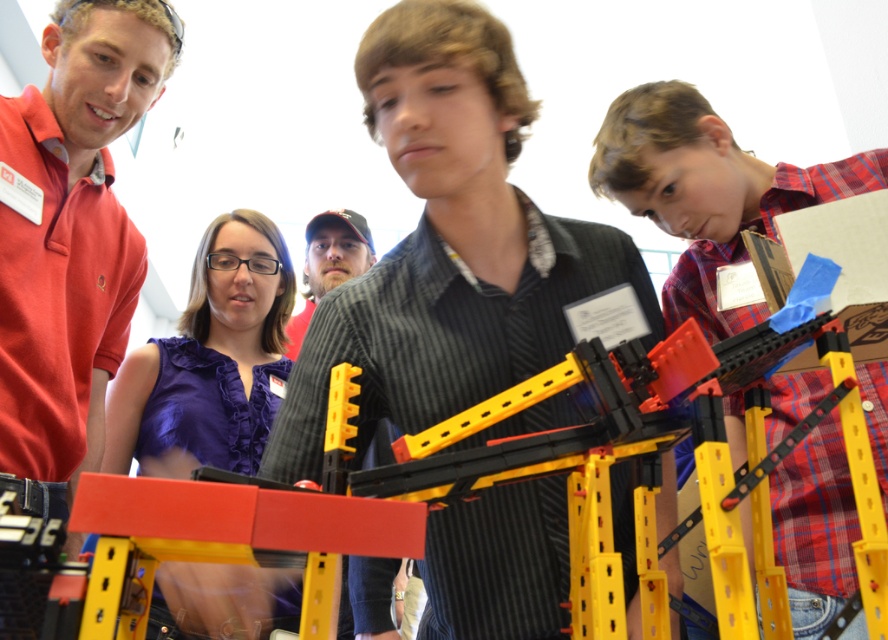
Question: Is matte red shirt at left smaller than purple fabric shirt at center?

Choices:
 (A) yes
 (B) no

Answer: (B)

Question: Observing the image, what is the correct spatial positioning of matte black shirt at center in reference to matte red shirt at left?

Choices:
 (A) left
 (B) right

Answer: (B)

Question: Based on their relative distances, which object is nearer to the red plastic lego at center?

Choices:
 (A) purple fabric shirt at center
 (B) matte black shirt at center
 (C) matte black cap at center

Answer: (B)

Question: Which object is farther from the camera taking this photo?

Choices:
 (A) matte red shirt at left
 (B) purple fabric shirt at center
 (C) matte black shirt at center
 (D) matte black cap at center

Answer: (D)

Question: Is red plastic lego at center in front of matte black cap at center?

Choices:
 (A) yes
 (B) no

Answer: (A)

Question: Which object appears farthest from the camera in this image?

Choices:
 (A) purple fabric shirt at center
 (B) red plastic lego at center
 (C) matte black cap at center
 (D) matte black shirt at center

Answer: (C)